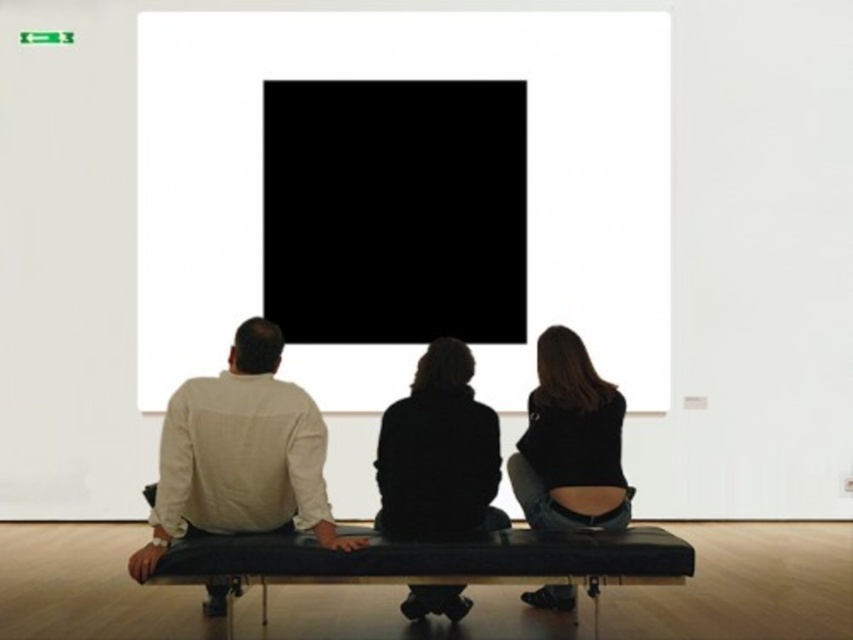
Who is higher up, white matte shirt at center or black leather bench at center?

white matte shirt at center

Looking at this image, which is more to the right, white matte shirt at center or black leather bench at center?

Positioned to the right is black leather bench at center.

Does point (149, 502) lie behind point (561, 540)?

Yes, point (149, 502) is farther from viewer.

The height and width of the screenshot is (640, 853). I want to click on white matte shirt at center, so click(x=239, y=456).

How much distance is there between black leather bench at center and black leather jacket at center?

They are 17.39 inches apart.

Is point (337, 577) farther from camera compared to point (563, 438)?

No, (337, 577) is closer to viewer.

Where is `black leather bench at center`? This screenshot has width=853, height=640. black leather bench at center is located at coordinates (432, 561).

Which of these two, matte black bench at center or black leather bench at center, stands shorter?

black leather bench at center

Between matte black bench at center and black leather bench at center, which one appears on the right side from the viewer's perspective?

black leather bench at center

The width and height of the screenshot is (853, 640). Describe the element at coordinates (438, 452) in the screenshot. I see `matte black bench at center` at that location.

Image resolution: width=853 pixels, height=640 pixels. Identify the location of matte black bench at center. (438, 452).